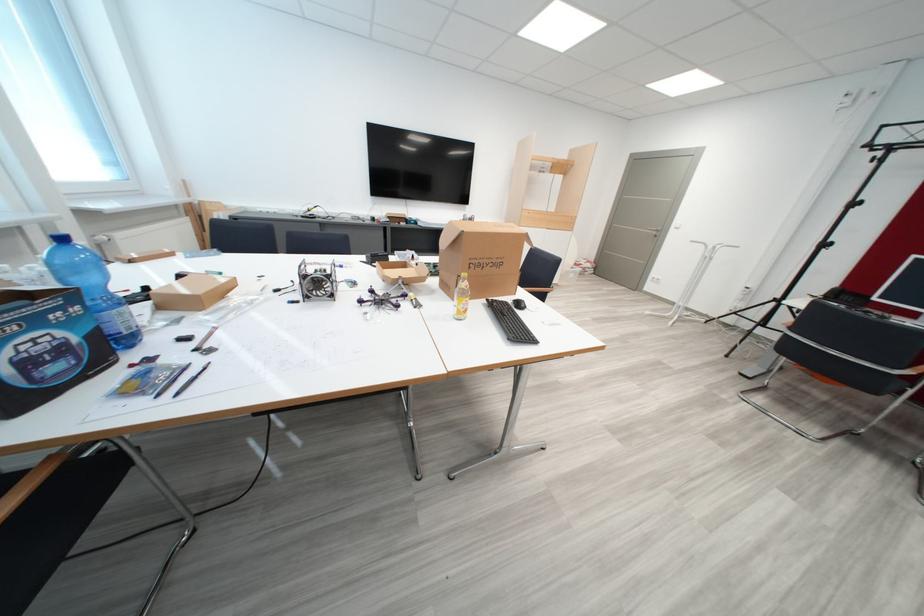
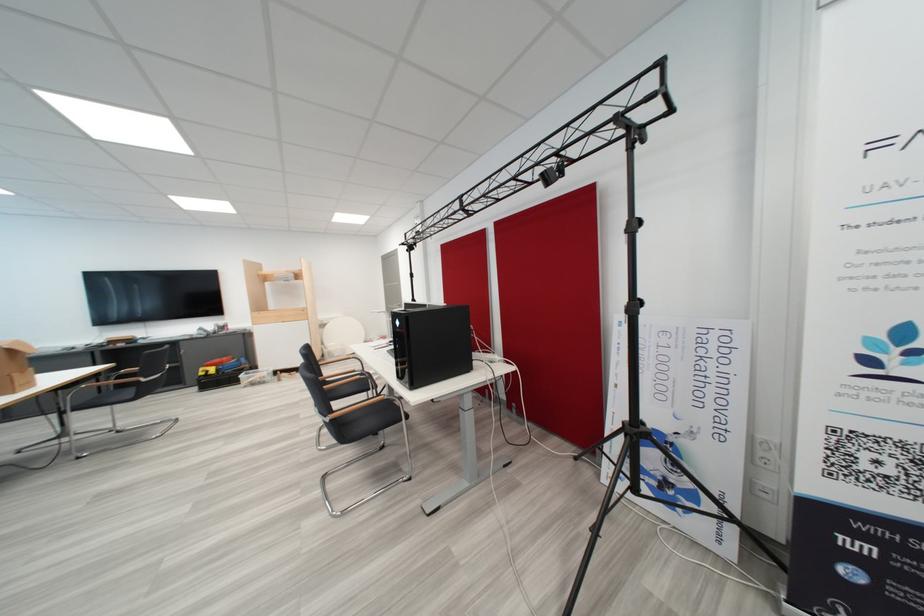
Question: Which direction would the cameraman need to move to produce the second image? Reply with the corresponding letter.

Choices:
 (A) Left
 (B) Right
 (C) Forward
 (D) Backward

Answer: (B)